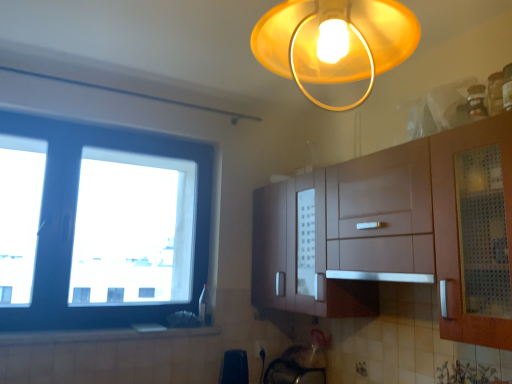
Question: Does white glossy electric outlet at lower center contain black plastic bag at lower center?

Choices:
 (A) no
 (B) yes

Answer: (A)

Question: Would you consider white glossy electric outlet at lower center to be distant from black plastic bag at lower center?

Choices:
 (A) yes
 (B) no

Answer: (B)

Question: Can you confirm if white glossy electric outlet at lower center is positioned to the right of black plastic bag at lower center?

Choices:
 (A) yes
 (B) no

Answer: (A)

Question: Does white glossy electric outlet at lower center have a smaller size compared to black plastic bag at lower center?

Choices:
 (A) no
 (B) yes

Answer: (B)

Question: Is white glossy electric outlet at lower center closer to camera compared to black plastic bag at lower center?

Choices:
 (A) yes
 (B) no

Answer: (B)

Question: From the image's perspective, is blue plastic window at left above or below satin silver exhaust hood at center?

Choices:
 (A) above
 (B) below

Answer: (A)

Question: Considering the positions of point (112, 251) and point (392, 274), is point (112, 251) closer or farther from the camera than point (392, 274)?

Choices:
 (A) closer
 (B) farther

Answer: (B)

Question: From a real-world perspective, is blue plastic window at left physically located above or below satin silver exhaust hood at center?

Choices:
 (A) below
 (B) above

Answer: (B)

Question: Would you say blue plastic window at left is to the left or to the right of satin silver exhaust hood at center in the picture?

Choices:
 (A) right
 (B) left

Answer: (B)

Question: Which is correct: blue plastic window at left is inside matte yellow plastic lampshade at upper center, or outside of it?

Choices:
 (A) inside
 (B) outside

Answer: (B)

Question: From the image's perspective, is blue plastic window at left located above or below matte yellow plastic lampshade at upper center?

Choices:
 (A) above
 (B) below

Answer: (B)

Question: From a real-world perspective, is blue plastic window at left above or below matte yellow plastic lampshade at upper center?

Choices:
 (A) above
 (B) below

Answer: (B)

Question: Is point (80, 155) closer or farther from the camera than point (390, 21)?

Choices:
 (A) closer
 (B) farther

Answer: (B)

Question: Would you say satin silver exhaust hood at center is to the left or to the right of white glossy electric outlet at lower center in the picture?

Choices:
 (A) left
 (B) right

Answer: (B)

Question: Is satin silver exhaust hood at center bigger or smaller than white glossy electric outlet at lower center?

Choices:
 (A) big
 (B) small

Answer: (A)